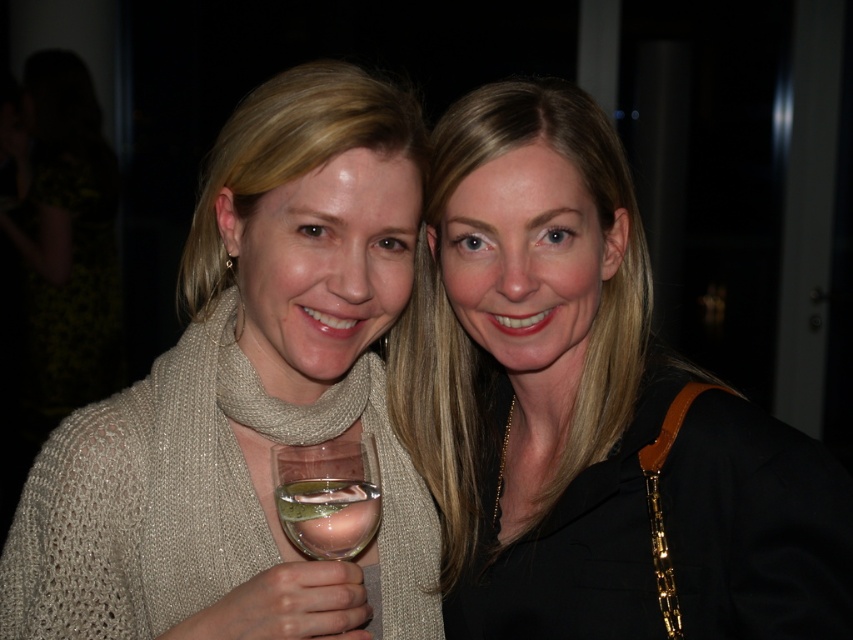
Question: From the image, what is the correct spatial relationship of beige knitted scarf at left in relation to clear glass wine glass at center?

Choices:
 (A) right
 (B) left

Answer: (B)

Question: Can you confirm if matte black jacket at center is positioned below beige knitted scarf at left?

Choices:
 (A) yes
 (B) no

Answer: (B)

Question: Which of the following is the farthest from the observer?

Choices:
 (A) clear glass wine at lower center
 (B) knitted beige scarf at center

Answer: (A)

Question: Can you confirm if clear glass wine glass at center is wider than clear glass wine at lower center?

Choices:
 (A) yes
 (B) no

Answer: (A)

Question: Among these points, which one is farthest from the camera?

Choices:
 (A) (577, 465)
 (B) (312, 545)
 (C) (136, 470)
 (D) (340, 496)

Answer: (A)

Question: Among these points, which one is farthest from the camera?

Choices:
 (A) (258, 396)
 (B) (549, 481)

Answer: (B)